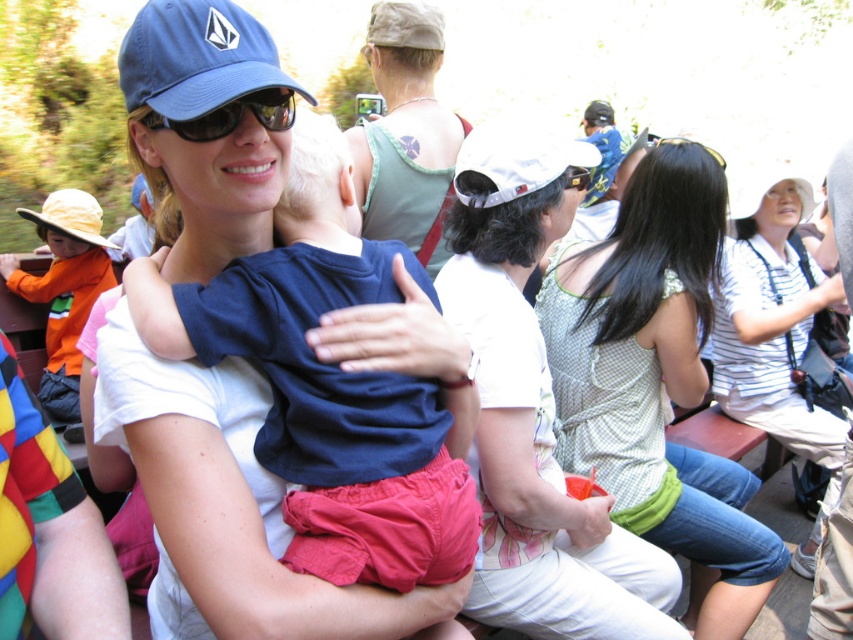
Can you confirm if white striped shirt at center is thinner than green fabric tank top at upper center?

No.

The width and height of the screenshot is (853, 640). What are the coordinates of `white striped shirt at center` in the screenshot? It's located at (775, 332).

Based on the photo, can you confirm if orange cotton shirt at left is positioned to the right of yellow fabric baseball hat at left?

Incorrect, orange cotton shirt at left is not on the right side of yellow fabric baseball hat at left.

Who is taller, orange cotton shirt at left or yellow fabric baseball hat at left?

With more height is orange cotton shirt at left.

Which is in front, point (65, 419) or point (86, 196)?

Point (65, 419) is more forward.

Identify the location of orange cotton shirt at left. The height and width of the screenshot is (640, 853). (62, 289).

Is white striped shirt at center smaller than black plastic goggles at upper center?

No, white striped shirt at center is not smaller than black plastic goggles at upper center.

Is white striped shirt at center above black plastic goggles at upper center?

No, white striped shirt at center is not above black plastic goggles at upper center.

Between point (825, 410) and point (584, 182), which one is positioned behind?

Point (825, 410)

Where is `white striped shirt at center`? Image resolution: width=853 pixels, height=640 pixels. white striped shirt at center is located at coordinates (775, 332).